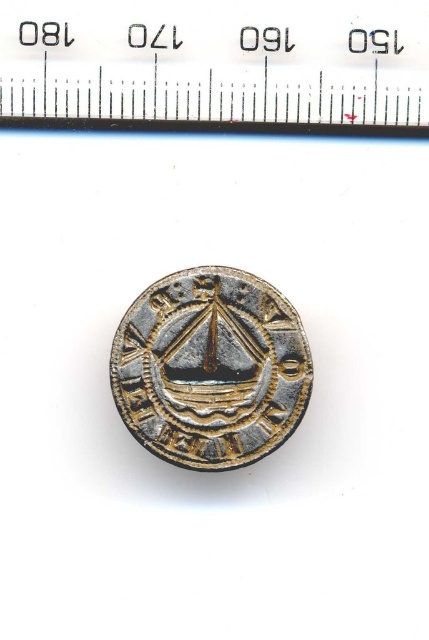
Who is more forward, (286,68) or (168,362)?

Point (168,362) is more forward.

Which is below, metallic ruler at upper center or gold plated coin at center?

gold plated coin at center is below.

Between point (0, 54) and point (196, 404), which one is positioned behind?

The point (196, 404) is more distant.

This screenshot has height=640, width=429. I want to click on metallic ruler at upper center, so [x=215, y=61].